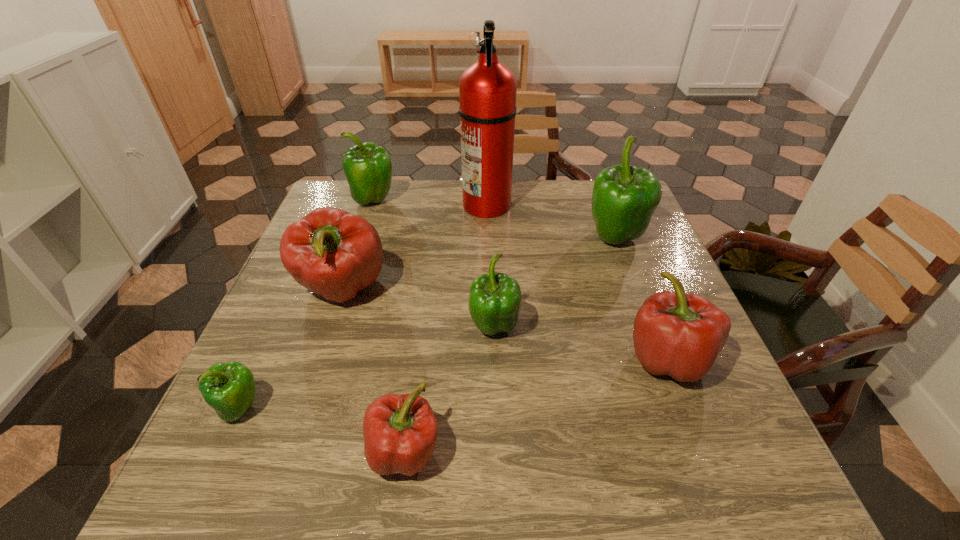
This screenshot has width=960, height=540. Identify the location of vacant space in between the red fire extinguisher and the fifth object from right to left. (445, 328).

The height and width of the screenshot is (540, 960). What are the coordinates of `unoccupied area between the tallest object and the farthest pink bell pepper` in the screenshot? It's located at 415,247.

Image resolution: width=960 pixels, height=540 pixels. I want to click on vacant point located between the rightmost green bell pepper and the second biggest green bell pepper, so click(x=494, y=219).

Select which object is the seventh closest to the tallest object. Please provide its 2D coordinates. Your answer should be formatted as a tuple, i.e. [(x, y)], where the tuple contains the x and y coordinates of a point satisfying the conditions above.

[(229, 388)]

Locate which object ranks fifth in proximity to the farthest pink bell pepper. Please provide its 2D coordinates. Your answer should be formatted as a tuple, i.e. [(x, y)], where the tuple contains the x and y coordinates of a point satisfying the conditions above.

[(400, 431)]

Find the location of `the fifth closest bell pepper relative to the second farthest bell pepper`. the fifth closest bell pepper relative to the second farthest bell pepper is located at coordinates (400, 431).

Locate an element on the screen. bell pepper that is the fourth closest one to the third smallest green bell pepper is located at coordinates (229, 388).

Find the location of a particular element. green bell pepper that is the second closest one to the fire extinguisher is located at coordinates (368, 169).

Identify which green bell pepper is the third closest to the second tallest object. Please provide its 2D coordinates. Your answer should be formatted as a tuple, i.e. [(x, y)], where the tuple contains the x and y coordinates of a point satisfying the conditions above.

[(229, 388)]

Locate an element on the screen. This screenshot has width=960, height=540. pink bell pepper object that ranks as the second closest to the third nearest green bell pepper is located at coordinates (x=333, y=253).